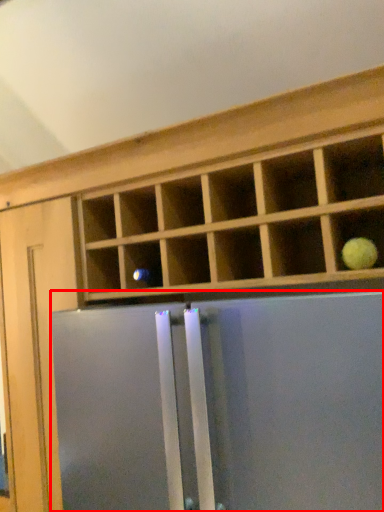
Question: From the image's perspective, what is the correct spatial relationship of screen door (annotated by the red box) in relation to fruit?

Choices:
 (A) below
 (B) above

Answer: (A)